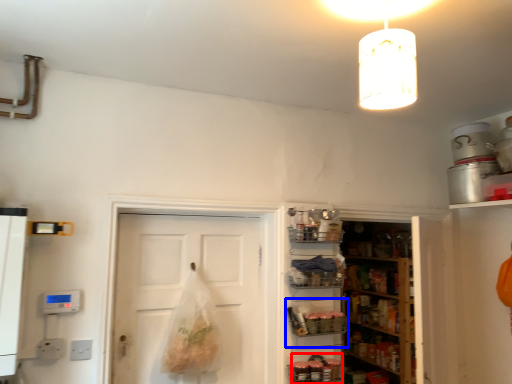
Question: Which object appears farthest to the camera in this image, food (highlighted by a red box) or shelf (highlighted by a blue box)?

Choices:
 (A) food
 (B) shelf

Answer: (B)